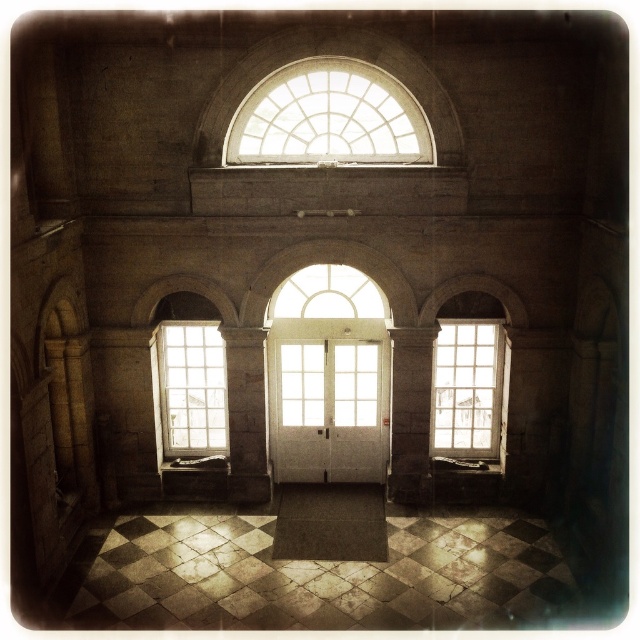
Can you confirm if clear glass window at right is wider than clear glass window at center left?

Indeed, clear glass window at right has a greater width compared to clear glass window at center left.

How much distance is there between clear glass window at right and clear glass window at center left?

19.33 feet

Which is behind, point (472, 362) or point (220, 419)?

Positioned behind is point (220, 419).

This screenshot has width=640, height=640. In order to click on clear glass window at right in this screenshot , I will do [467, 388].

Locate an element on the screen. clear glass dome at upper center is located at coordinates (328, 118).

Does clear glass window at center left have a smaller size compared to clear glass window at center?

Incorrect, clear glass window at center left is not smaller in size than clear glass window at center.

Looking at this image, does clear glass window at center left appear on the left side of clear glass window at center?

Correct, you'll find clear glass window at center left to the left of clear glass window at center.

The height and width of the screenshot is (640, 640). Find the location of `clear glass window at center left`. clear glass window at center left is located at coordinates (192, 387).